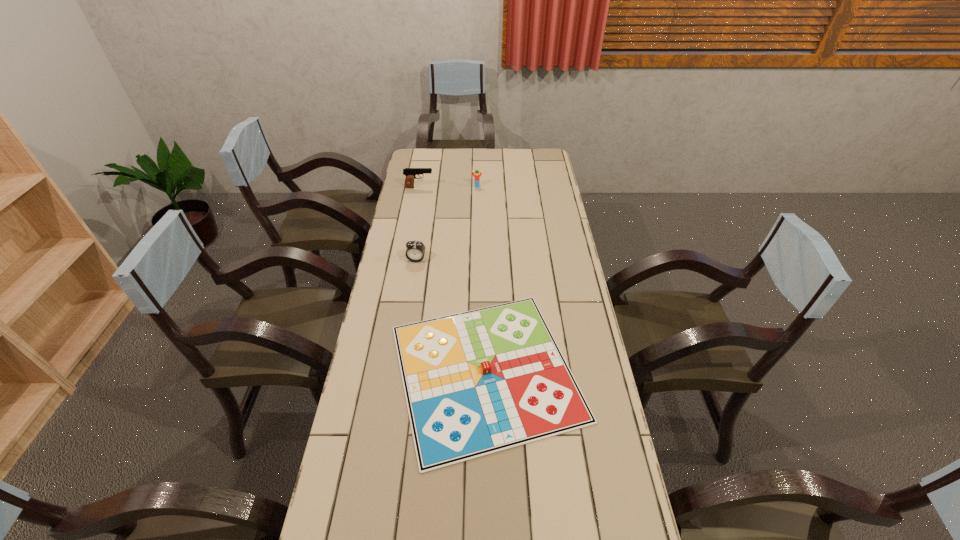
Where is `free space that is in between the nearest object and the Lego`? This screenshot has height=540, width=960. free space that is in between the nearest object and the Lego is located at coordinates click(481, 279).

Where is `vacant area that lies between the pistol and the Lego`? This screenshot has height=540, width=960. vacant area that lies between the pistol and the Lego is located at coordinates (448, 187).

Choose which object is the nearest neighbor to the alarm clock. Please provide its 2D coordinates. Your answer should be formatted as a tuple, i.e. [(x, y)], where the tuple contains the x and y coordinates of a point satisfying the conditions above.

[(478, 382)]

Locate which object is the second closest to the nearest object. Please provide its 2D coordinates. Your answer should be formatted as a tuple, i.e. [(x, y)], where the tuple contains the x and y coordinates of a point satisfying the conditions above.

[(410, 173)]

Where is `vacant space that satisfies the following two spatial constraints: 1. on the front side of the gameboard; 2. on the right side of the alarm clock`? The width and height of the screenshot is (960, 540). vacant space that satisfies the following two spatial constraints: 1. on the front side of the gameboard; 2. on the right side of the alarm clock is located at coordinates point(398,372).